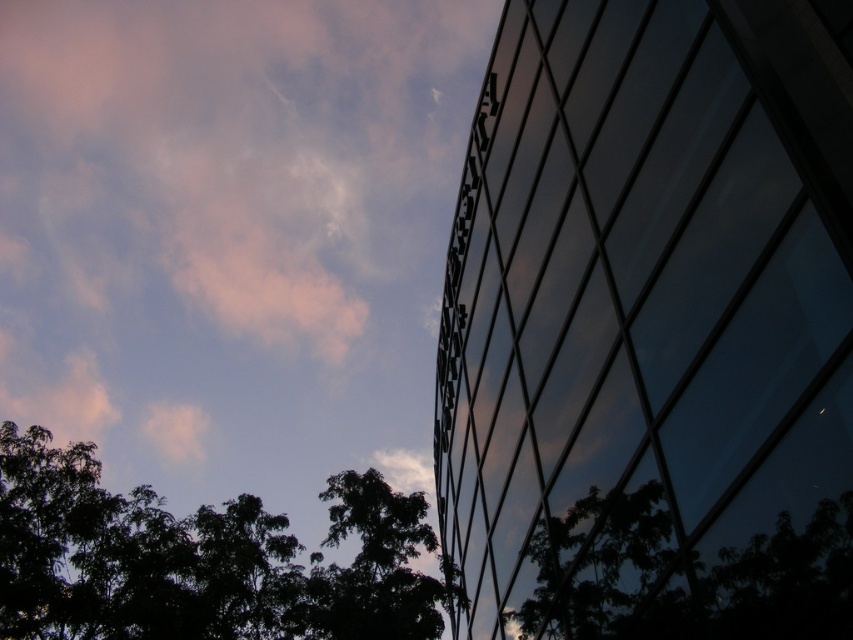
You are standing in front of the modern building and want to touch the transparent glass window at upper right. Given that you can reach up to 2 meters, can you reach it?

The transparent glass window at upper right is 5.11 meters from viewer, which is farther than your reach of 2 meters. You cannot reach it.

You are standing in front of the modern building and want to take a photo that includes both the dark green leafy tree at lower left and the dark green leafy tree at lower right. Which tree should you focus on to ensure both are in the frame without moving your camera position?

You should focus on the dark green leafy tree at lower right because it is shorter than the dark green leafy tree at lower left, allowing both to fit within the frame when centered on the shorter tree.